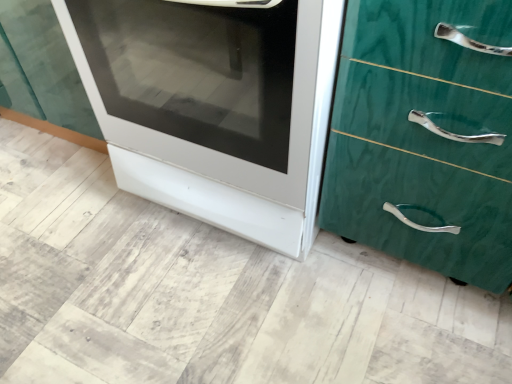
Question: Which is correct: green marble chest of drawers at right is inside white glossy oven at center, or outside of it?

Choices:
 (A) outside
 (B) inside

Answer: (A)

Question: From the image's perspective, is green marble chest of drawers at right located above or below white glossy oven at center?

Choices:
 (A) above
 (B) below

Answer: (B)

Question: From a real-world perspective, is green marble chest of drawers at right above or below white glossy oven at center?

Choices:
 (A) above
 (B) below

Answer: (A)

Question: From the image's perspective, is white glossy oven at center positioned above or below green marble chest of drawers at right?

Choices:
 (A) below
 (B) above

Answer: (B)

Question: In the image, is white glossy oven at center on the left side or the right side of green marble chest of drawers at right?

Choices:
 (A) right
 (B) left

Answer: (B)

Question: In terms of width, does white glossy oven at center look wider or thinner when compared to green marble chest of drawers at right?

Choices:
 (A) wide
 (B) thin

Answer: (A)

Question: In the image, is white glossy oven at center positioned in front of or behind green marble chest of drawers at right?

Choices:
 (A) front
 (B) behind

Answer: (B)